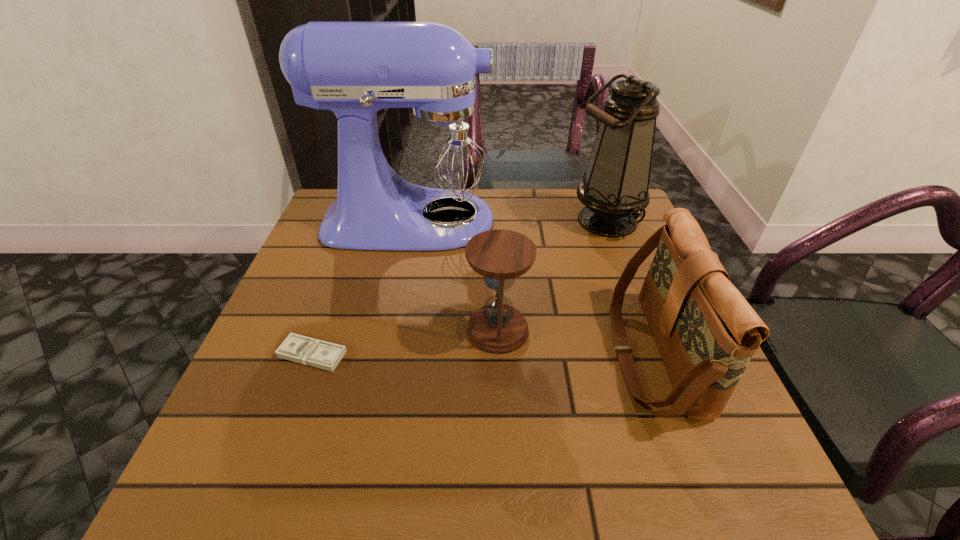
Locate an element on the screen. This screenshot has width=960, height=540. mixer is located at coordinates (427, 187).

Locate an element on the screen. The width and height of the screenshot is (960, 540). oil lamp is located at coordinates (614, 188).

Locate an element on the screen. shoulder bag is located at coordinates (706, 331).

What are the coordinates of `hourglass` in the screenshot? It's located at (500, 256).

I want to click on the shortest object, so click(305, 350).

Locate an element on the screen. blank space located at the mixing area of the mixer is located at coordinates (639, 221).

Locate an element on the screen. The width and height of the screenshot is (960, 540). vacant space situated on the left of the oil lamp is located at coordinates (x=430, y=220).

The image size is (960, 540). What are the coordinates of `free space located on the front-facing side of the shoulder bag` in the screenshot? It's located at (524, 354).

Find the location of a particular element. This screenshot has width=960, height=540. blank area located on the front-facing side of the shoulder bag is located at coordinates (466, 354).

Locate an element on the screen. This screenshot has width=960, height=540. vacant space located 0.170m on the front-facing side of the shoulder bag is located at coordinates (524, 354).